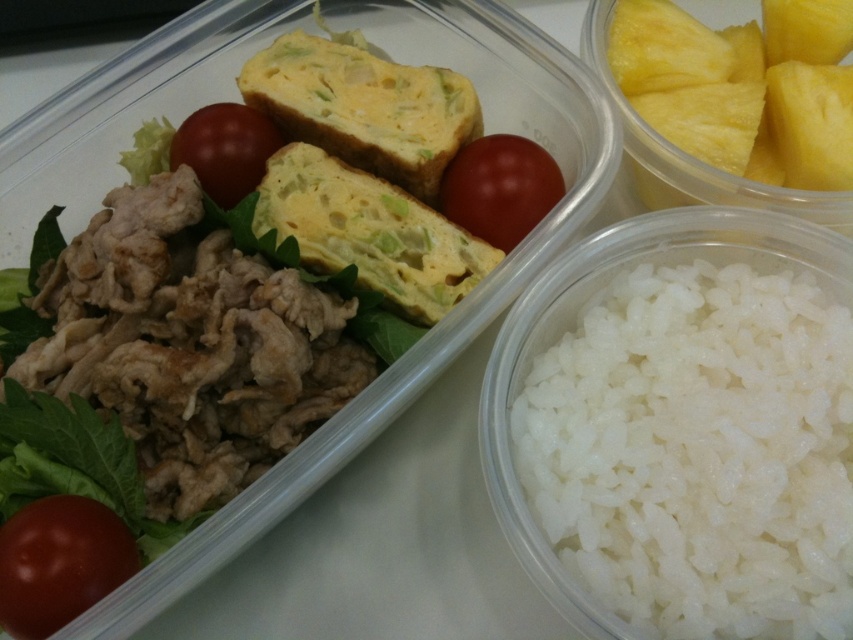
You are a food delivery person holding a large plate that is 32 inches wide. You need to place it on the white polished rice at lower right. Can you fit the plate there?

The white polished rice at lower right is 31.80 inches away from the viewer. Since the plate is 32 inches wide, it is slightly wider than the distance available, so the plate cannot be placed there without overlapping.

You are a food delivery driver who just picked up this meal. You need to deliver it without spilling. The container is rectangular with the opening at the top. There is a point marked at coordinates point (698, 451). What is the most likely content located at that point?

The point (698, 451) indicates white polished rice at lower right.